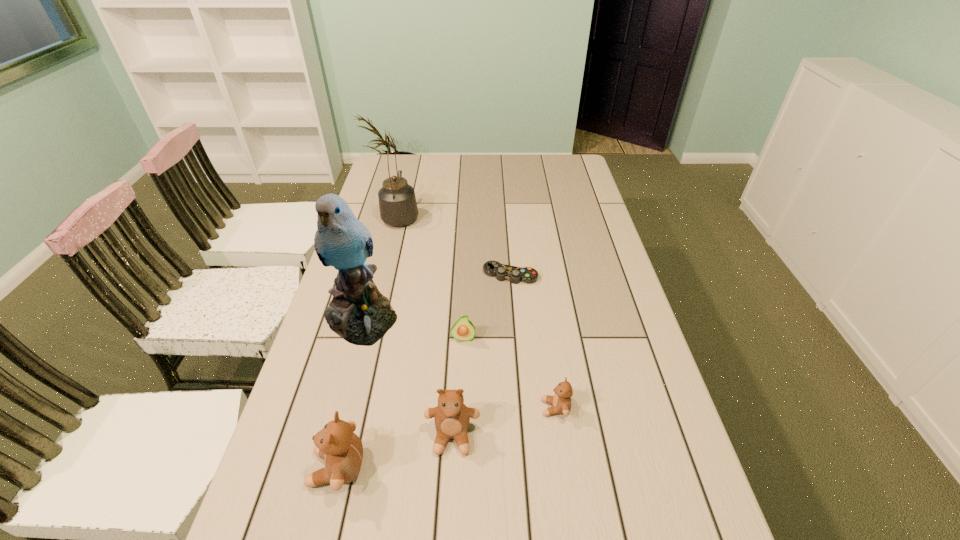
The height and width of the screenshot is (540, 960). Identify the location of free region located 0.160m on the face of the tallest object. (338, 404).

Find the location of `object that is at the near edge`. object that is at the near edge is located at coordinates (337, 444).

Where is `teddy bear at the left edge`? This screenshot has width=960, height=540. teddy bear at the left edge is located at coordinates (337, 444).

The width and height of the screenshot is (960, 540). I want to click on kettle positioned at the left edge, so click(x=397, y=202).

Find the location of a particular element. This screenshot has height=540, width=960. parakeet located at the left edge is located at coordinates (359, 313).

Identify the location of object present at the near left corner. (337, 444).

Find the location of a particular element. This screenshot has width=960, height=540. vacant space at the far edge is located at coordinates (478, 157).

Locate an element on the screen. vacant area at the near edge is located at coordinates (540, 515).

Locate an element on the screen. Image resolution: width=960 pixels, height=540 pixels. vacant point at the left edge is located at coordinates (321, 341).

The image size is (960, 540). I want to click on vacant area at the right edge of the desktop, so click(x=635, y=322).